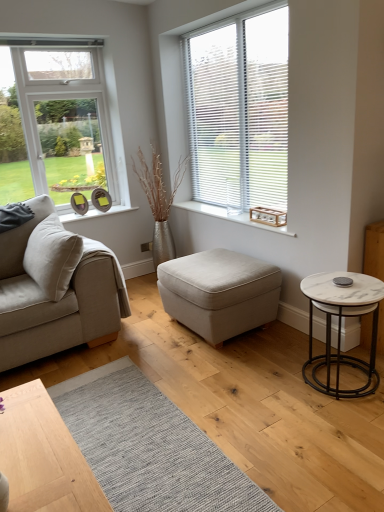
Locate an element on the screen. The width and height of the screenshot is (384, 512). blank space situated above light beige fabric ottoman at center (from a real-world perspective) is located at coordinates (215, 266).